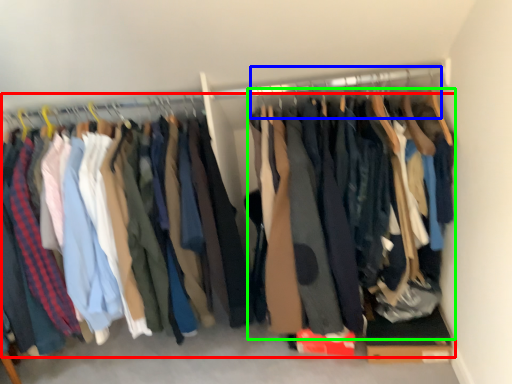
Question: Considering the real-world distances, which object is closest to trousers (highlighted by a red box)? hanger (highlighted by a blue box) or clothing (highlighted by a green box).

Choices:
 (A) hanger
 (B) clothing

Answer: (B)